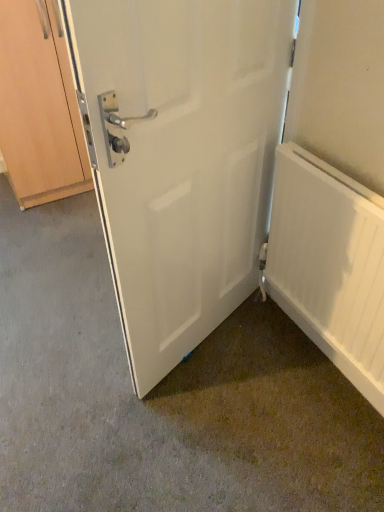
Question: From a real-world perspective, is white matte radiator at right physically located above or below white matte door at center?

Choices:
 (A) below
 (B) above

Answer: (A)

Question: Is point (278, 204) positioned closer to the camera than point (163, 137)?

Choices:
 (A) farther
 (B) closer

Answer: (A)

Question: Which of these objects is positioned closest to the white matte door at center?

Choices:
 (A) wooden cabinet at left
 (B) white matte radiator at right

Answer: (B)

Question: Which of these objects is positioned closest to the white matte radiator at right?

Choices:
 (A) wooden cabinet at left
 (B) white matte door at center

Answer: (B)